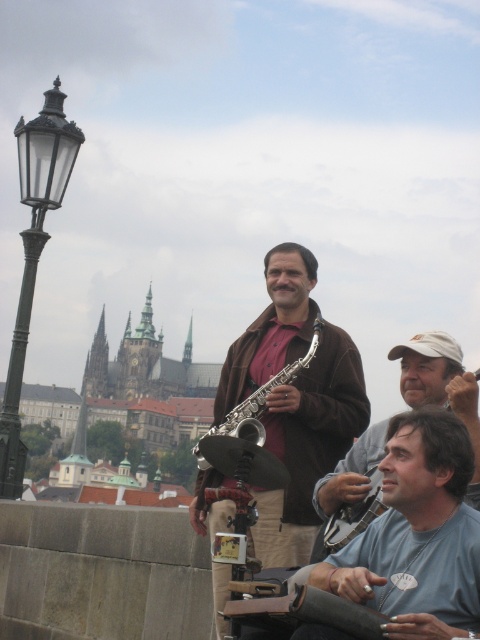
You are a photographer standing on the bridge where the musicians are performing. You want to take a photo of the brown suede jacket at center and the silver metallic saxophone at center such that both are clearly visible in the frame. Given that your camera has a minimum focus distance of 3 meters, will you be able to capture both objects in focus at the same time?

The brown suede jacket at center and silver metallic saxophone at center are 4.36 meters apart from each other. Since the camera requires a minimum focus distance of 3 meters, the distance between the two objects is sufficient for both to be in focus simultaneously.

You are a photographer standing on the bridge. You want to take a photo of the gray fabric shirt at center and the black glass lamp post at left. Which object should you focus on first if you want to capture both in the same frame without moving the camera?

The gray fabric shirt at center is located below the black glass lamp post at left, so you should focus on the black glass lamp post at left first since it is higher up in the frame.